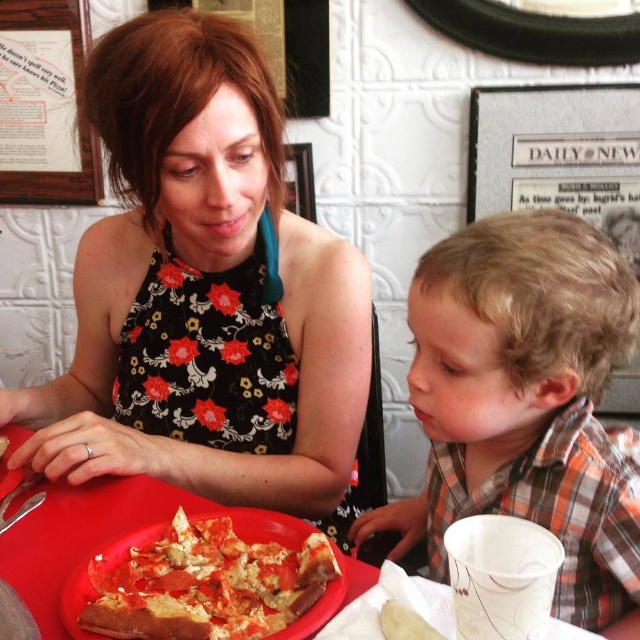
Looking at this image, is crusty golden-brown pizza at center shorter than red plastic plate at center?

Indeed, crusty golden-brown pizza at center has a lesser height compared to red plastic plate at center.

Does crusty golden-brown pizza at center appear on the left side of red plastic plate at center?

Incorrect, crusty golden-brown pizza at center is not on the left side of red plastic plate at center.

Is point (157, 634) positioned in front of point (164, 500)?

Yes.

What are the coordinates of `crusty golden-brown pizza at center` in the screenshot? It's located at (214, 580).

Can you confirm if plaid shirt at right is shorter than crusty golden-brown pizza at center?

In fact, plaid shirt at right may be taller than crusty golden-brown pizza at center.

Which of these two, plaid shirt at right or crusty golden-brown pizza at center, stands taller?

Standing taller between the two is plaid shirt at right.

Locate an element on the screen. Image resolution: width=640 pixels, height=640 pixels. plaid shirt at right is located at coordinates (525, 403).

You are a GUI agent. You are given a task and a screenshot of the screen. Output one action in this format:
    pyautogui.click(x=<x>, y=<y>)
    Task: Click on the plaid shirt at right
    Image resolution: width=640 pixels, height=640 pixels.
    Given the screenshot: What is the action you would take?
    pyautogui.click(x=525, y=403)

Does point (618, 618) come farther from viewer compared to point (230, 508)?

Yes, it is.

Is plaid shirt at right bigger than red plastic plate at center?

Yes, plaid shirt at right is bigger than red plastic plate at center.

The height and width of the screenshot is (640, 640). What do you see at coordinates (525, 403) in the screenshot?
I see `plaid shirt at right` at bounding box center [525, 403].

Locate an element on the screen. plaid shirt at right is located at coordinates pos(525,403).